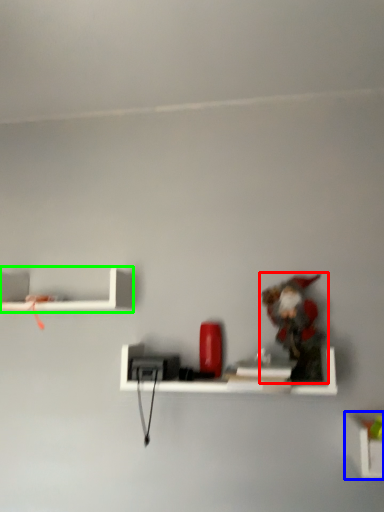
Question: Which object is positioned closest to toy (highlighted by a red box)? Select from shelf (highlighted by a blue box) and shelf (highlighted by a green box).

Choices:
 (A) shelf
 (B) shelf

Answer: (A)